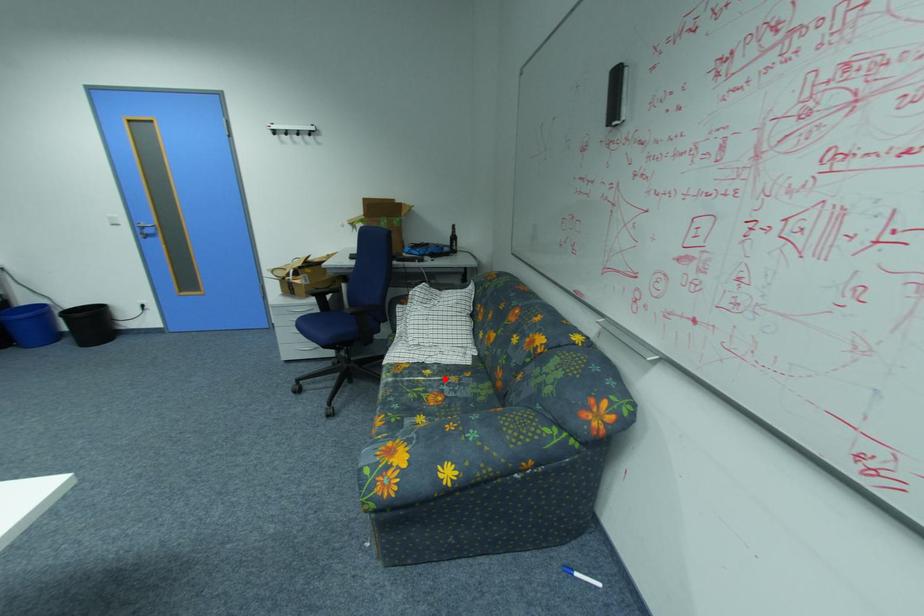
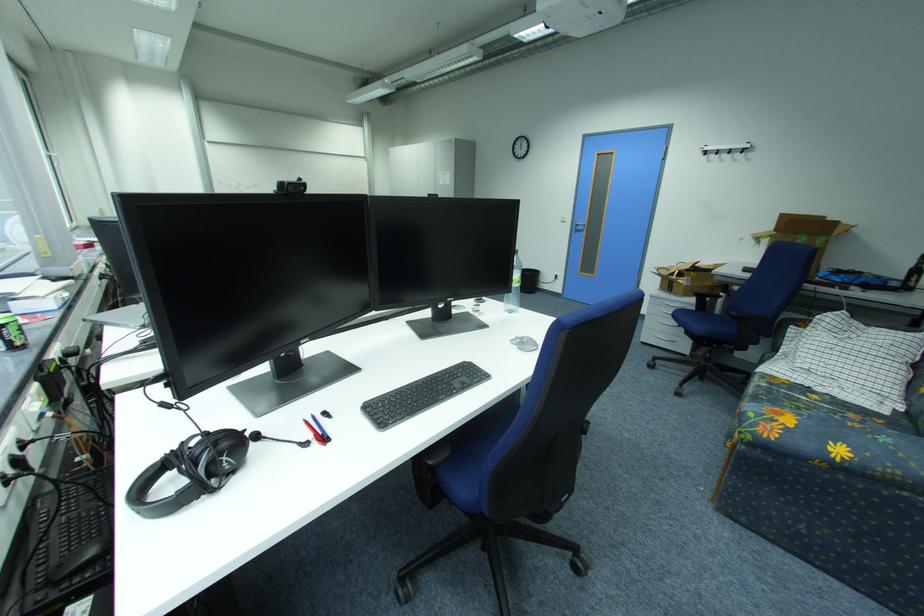
Question: I am providing you with two images of the same scene from different viewpoints. A red point is marked on the first image. At the location where the point appears in image 1, is it still visible in image 2?

Choices:
 (A) Yes
 (B) No

Answer: (A)